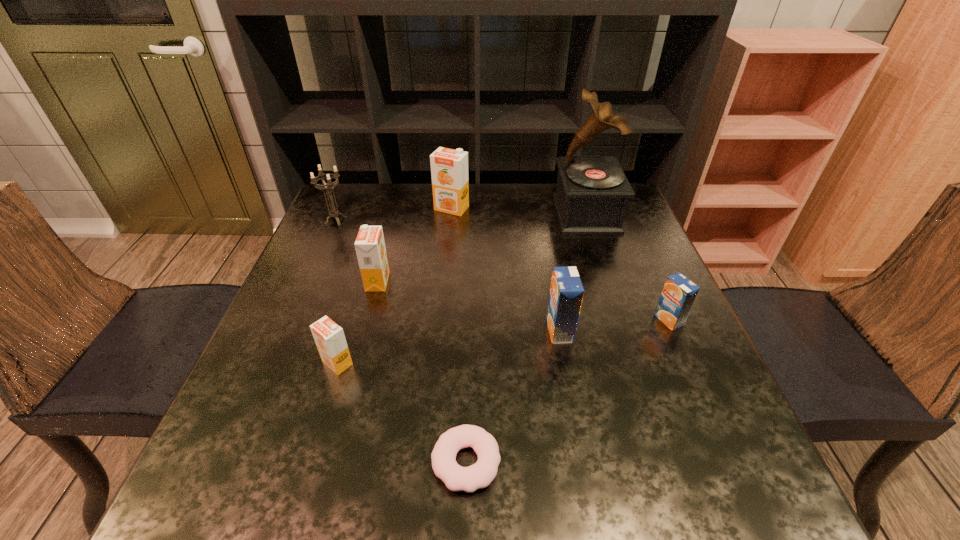
I want to click on the smallest orange orange juice, so click(x=329, y=337).

Identify the location of the seventh farthest object. The height and width of the screenshot is (540, 960). (329, 337).

At what (x,y) coordinates should I click in order to perform the action: click on the nearest object. Please return your answer as a coordinate pair (x, y). This screenshot has width=960, height=540. Looking at the image, I should click on (479, 475).

Find the location of a particular element. doughnut is located at coordinates (479, 475).

The width and height of the screenshot is (960, 540). In order to click on vacant space located at the horn opening of the tallest object in this screenshot , I will do `click(471, 214)`.

Identify the location of vacant space located at the horn opening of the tallest object. (475, 214).

Find the location of `vacant space positioned 0.090m at the horn opening of the tallest object`. vacant space positioned 0.090m at the horn opening of the tallest object is located at coordinates (524, 214).

Where is `vacant area situated 0.210m on the front of the farthest orange juice`? This screenshot has height=540, width=960. vacant area situated 0.210m on the front of the farthest orange juice is located at coordinates (446, 264).

Where is `vacant space located 0.290m on the right of the leftmost object`? The height and width of the screenshot is (540, 960). vacant space located 0.290m on the right of the leftmost object is located at coordinates (451, 220).

At what (x,y) coordinates should I click in order to perform the action: click on vacant space located 0.400m on the back of the fourth farthest object. Please return your answer as a coordinate pair (x, y). Looking at the image, I should click on (402, 188).